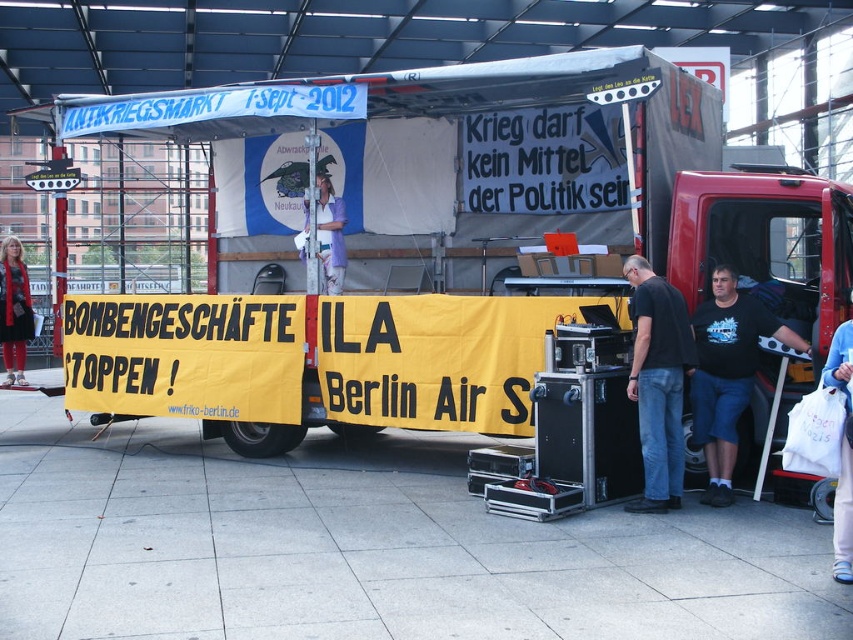
You are a photographer at the event. You want to take a photo of the matte black truck at right and the black matte shirt at center. Which object will appear smaller in the photo?

The black matte shirt at center appears smaller in the photo because it is farther away from the photographer than the matte black truck at right.

You are a photographer standing at the center of the scene. You want to capture a photo of the red truck with its banners clearly visible. However, there is a white plastic bag at lower right in the way. Where should you move to avoid the bag while still keeping the truck in frame?

Move to the left side of the scene. Since the white plastic bag at lower right is located at point (842, 449), moving left would place the photographer away from the bag while still keeping the truck visible in the frame.

You are a photographer trying to capture both the matte black truck at right and the black matte shirt at center in a single frame. Based on their sizes in the image, which object would appear bigger in your photo?

The matte black truck at right appears bigger in the photo because its width is larger than that of the black matte shirt at center.